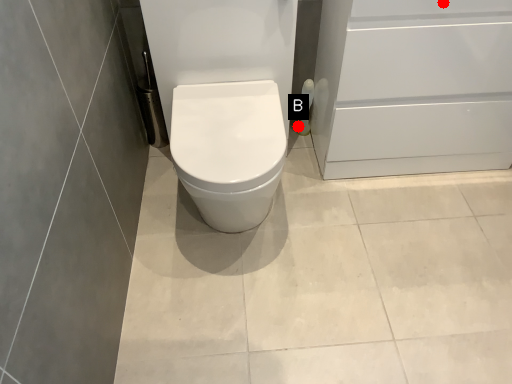
Question: Two points are circled on the image, labeled by A and B beside each circle. Which of the following is the closest to the observer?

Choices:
 (A) A is closer
 (B) B is closer

Answer: (A)